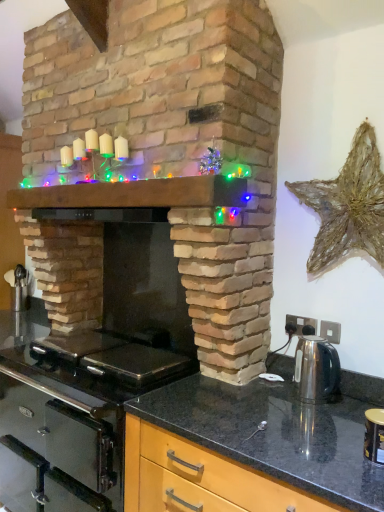
Question: Can you confirm if brick fireplace at center is smaller than matte black countertop at lower right?

Choices:
 (A) no
 (B) yes

Answer: (A)

Question: From a real-world perspective, is brick fireplace at center located higher than matte black countertop at lower right?

Choices:
 (A) no
 (B) yes

Answer: (B)

Question: Can you confirm if brick fireplace at center is bigger than matte black countertop at lower right?

Choices:
 (A) no
 (B) yes

Answer: (B)

Question: From the image's perspective, is brick fireplace at center above matte black countertop at lower right?

Choices:
 (A) yes
 (B) no

Answer: (A)

Question: Can you confirm if brick fireplace at center is shorter than matte black countertop at lower right?

Choices:
 (A) no
 (B) yes

Answer: (A)

Question: Would you say wooden mantel at center is inside or outside matte black countertop at lower right?

Choices:
 (A) outside
 (B) inside

Answer: (A)

Question: Considering the positions of wooden mantel at center and matte black countertop at lower right in the image, is wooden mantel at center bigger or smaller than matte black countertop at lower right?

Choices:
 (A) big
 (B) small

Answer: (B)

Question: Visually, is wooden mantel at center positioned to the left or to the right of matte black countertop at lower right?

Choices:
 (A) right
 (B) left

Answer: (B)

Question: From a real-world perspective, is wooden mantel at center above or below matte black countertop at lower right?

Choices:
 (A) above
 (B) below

Answer: (A)

Question: Choose the correct answer: Is satin silver kettle at right inside wooden mantel at center or outside it?

Choices:
 (A) outside
 (B) inside

Answer: (A)

Question: In the image, is satin silver kettle at right on the left side or the right side of wooden mantel at center?

Choices:
 (A) right
 (B) left

Answer: (A)

Question: From a real-world perspective, is satin silver kettle at right above or below wooden mantel at center?

Choices:
 (A) below
 (B) above

Answer: (A)

Question: Is satin silver kettle at right bigger or smaller than wooden mantel at center?

Choices:
 (A) small
 (B) big

Answer: (A)

Question: Is black glass gas stove at lower left inside or outside of matte black countertop at lower right?

Choices:
 (A) outside
 (B) inside

Answer: (A)

Question: Is black glass gas stove at lower left bigger or smaller than matte black countertop at lower right?

Choices:
 (A) small
 (B) big

Answer: (A)